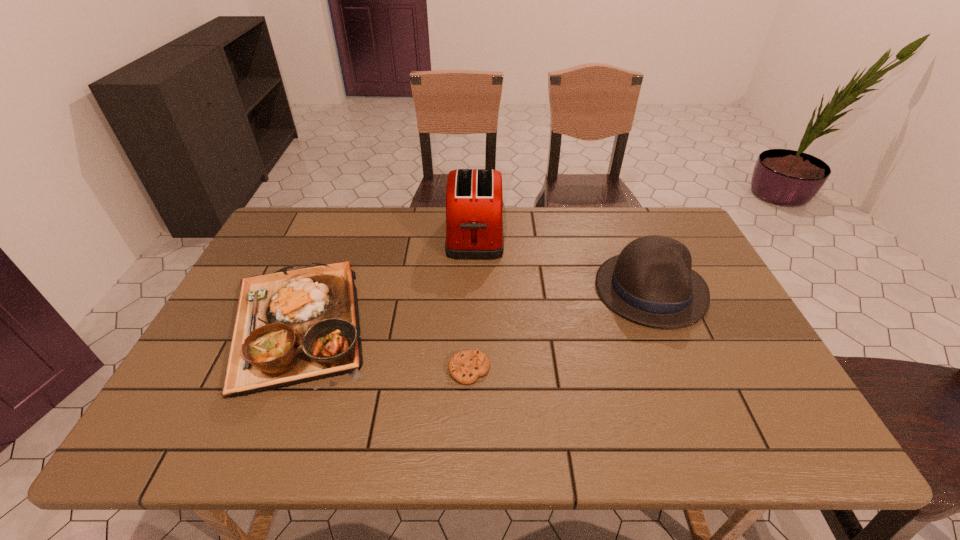
The height and width of the screenshot is (540, 960). What are the coordinates of `object present at the far edge` in the screenshot? It's located at (474, 198).

This screenshot has height=540, width=960. I want to click on object present at the left edge, so click(x=295, y=326).

Identify the location of object situated at the right edge. The width and height of the screenshot is (960, 540). (650, 282).

Find the location of a particular element. This screenshot has height=540, width=960. free spot at the far edge of the desktop is located at coordinates (349, 217).

You are a GUI agent. You are given a task and a screenshot of the screen. Output one action in this format:
    pyautogui.click(x=<x>, y=<y>)
    Task: Click on the blank space at the near edge
    The width and height of the screenshot is (960, 540).
    Given the screenshot: What is the action you would take?
    pyautogui.click(x=531, y=422)

You are a GUI agent. You are given a task and a screenshot of the screen. Output one action in this format:
    pyautogui.click(x=<x>, y=<y>)
    Task: Click on the vacant space at the left edge of the desktop
    This screenshot has height=540, width=960.
    Given the screenshot: What is the action you would take?
    pyautogui.click(x=233, y=406)

The image size is (960, 540). I want to click on vacant space at the far left corner, so click(293, 247).

In the image, there is a desktop. Where is `vacant space at the far right corner`? The height and width of the screenshot is (540, 960). vacant space at the far right corner is located at coordinates (655, 218).

At what (x,y) coordinates should I click in order to perform the action: click on free spot between the shortest object and the toaster. Please return your answer as a coordinate pair (x, y). Image resolution: width=960 pixels, height=540 pixels. Looking at the image, I should click on (472, 302).

Locate an element on the screen. free spot between the leftmost object and the cookie is located at coordinates (383, 347).